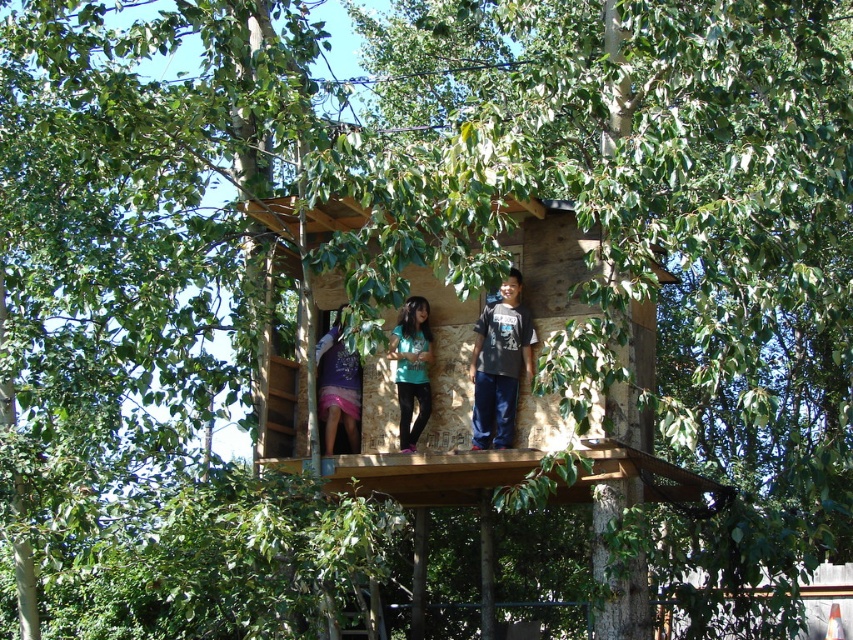
Who is positioned more to the right, dark gray t-shirt at center or matte purple dress at center?

Positioned to the right is dark gray t-shirt at center.

Is dark gray t-shirt at center thinner than matte purple dress at center?

Indeed, dark gray t-shirt at center has a lesser width compared to matte purple dress at center.

Is point (515, 276) farther from camera compared to point (335, 381)?

No.

Where is `dark gray t-shirt at center`? The height and width of the screenshot is (640, 853). dark gray t-shirt at center is located at coordinates (498, 364).

Which is above, dark gray t-shirt at center or teal matte shirt at center?

teal matte shirt at center

Is dark gray t-shirt at center taller than teal matte shirt at center?

No.

Where is `dark gray t-shirt at center`? This screenshot has height=640, width=853. dark gray t-shirt at center is located at coordinates (498, 364).

Is teal matte shirt at center positioned before matte purple dress at center?

Yes, it is.

In the scene shown: Between teal matte shirt at center and matte purple dress at center, which one has more height?

Standing taller between the two is teal matte shirt at center.

Identify the location of teal matte shirt at center. (410, 368).